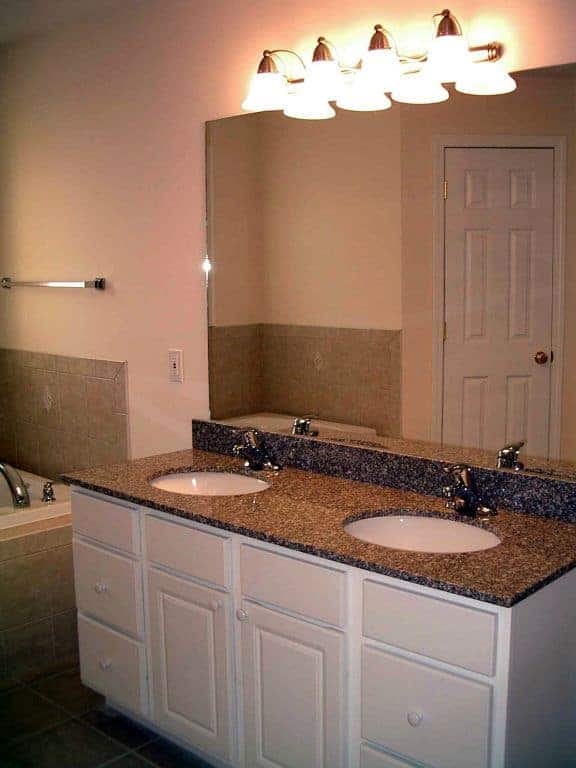
This screenshot has height=768, width=576. Find the location of `mirror`. mirror is located at coordinates (473, 313).